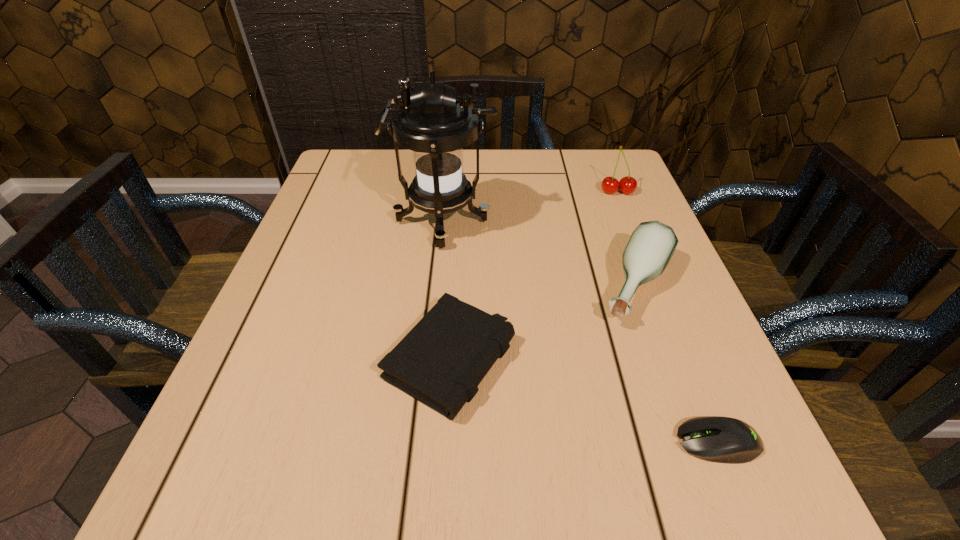
The height and width of the screenshot is (540, 960). Identify the location of lantern. (436, 125).

Where is `the fourth shortest object`? the fourth shortest object is located at coordinates coord(627,185).

At what (x,y) coordinates should I click in order to perform the action: click on bottle. Please return your answer as a coordinate pair (x, y). The image size is (960, 540). Looking at the image, I should click on (648, 251).

The image size is (960, 540). Find the location of `Bible`. Bible is located at coordinates (441, 361).

You are a GUI agent. You are given a task and a screenshot of the screen. Output one action in this format:
    pyautogui.click(x=<x>, y=<y>)
    Task: Click on the computer mouse
    The image size is (960, 540).
    Given the screenshot: What is the action you would take?
    pyautogui.click(x=718, y=439)

Find the location of `vacant point located 0.350m on the right of the lantern`. vacant point located 0.350m on the right of the lantern is located at coordinates (646, 222).

Image resolution: width=960 pixels, height=540 pixels. Identify the location of free location located with the stems of the fourth shortest object pointing upwards. (635, 235).

Identify the location of vacant space located 0.230m on the left of the third shortest object. (477, 287).

Where is `blank area located on the back of the Bible`? The width and height of the screenshot is (960, 540). blank area located on the back of the Bible is located at coordinates (457, 241).

Locate an element on the screen. Image resolution: width=960 pixels, height=540 pixels. free location located on the wheel side of the shortest object is located at coordinates (406, 442).